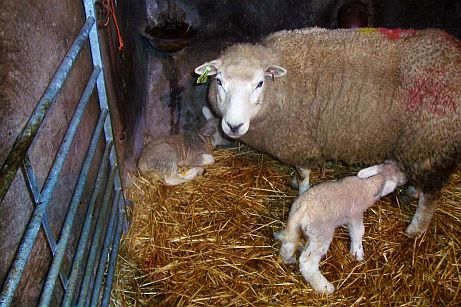
Where is `bowl`? The height and width of the screenshot is (307, 461). bowl is located at coordinates (169, 37).